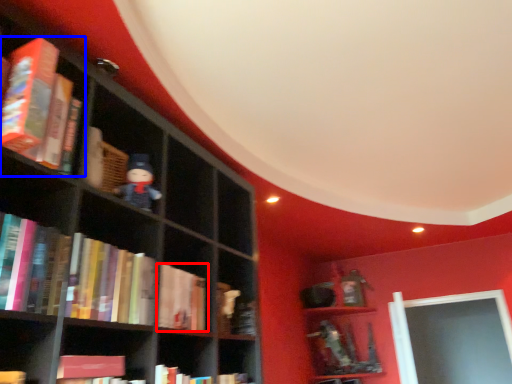
Question: Which object is further to the camera taking this photo, book (highlighted by a red box) or book (highlighted by a blue box)?

Choices:
 (A) book
 (B) book

Answer: (A)